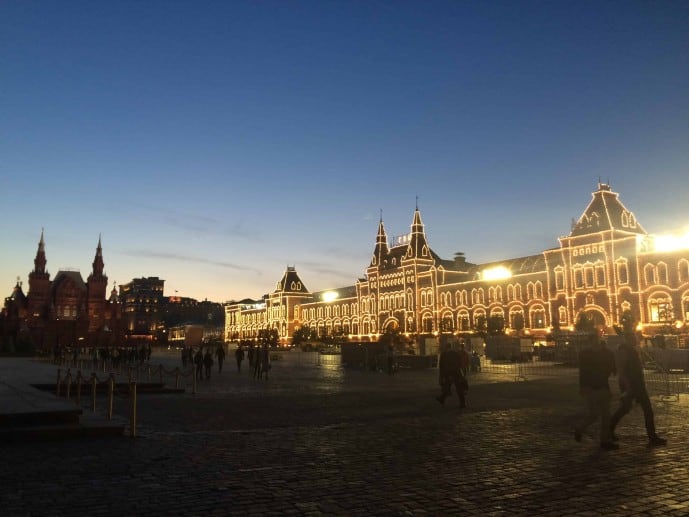
This screenshot has width=689, height=517. Find the location of `chimney`. chimney is located at coordinates (460, 256).